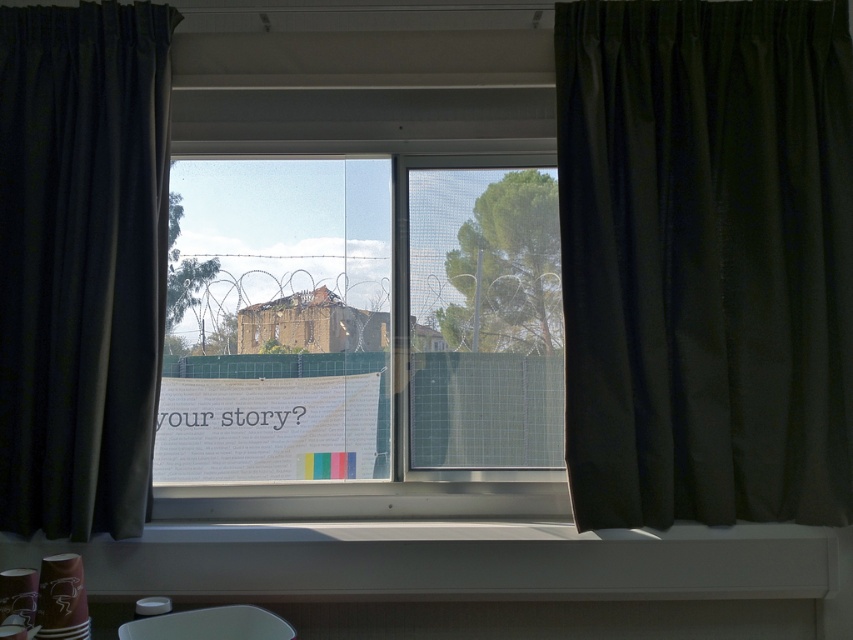
Locate an element on the screen. The image size is (853, 640). black silk curtain at right is located at coordinates (706, 259).

Measure the distance from black silk curtain at right to black fabric curtain at left.

black silk curtain at right and black fabric curtain at left are 1.14 meters apart from each other.

The image size is (853, 640). What are the coordinates of `black silk curtain at right` in the screenshot? It's located at (706, 259).

Does point (167, 44) come in front of point (294, 532)?

That is False.

The width and height of the screenshot is (853, 640). What do you see at coordinates (80, 262) in the screenshot?
I see `black fabric curtain at left` at bounding box center [80, 262].

Is point (79, 358) positioned before point (157, 566)?

Yes, point (79, 358) is in front of point (157, 566).

Locate an element on the screen. The height and width of the screenshot is (640, 853). black fabric curtain at left is located at coordinates (80, 262).

Can you confirm if black silk curtain at right is positioned below white plastic window sill at lower center?

No, black silk curtain at right is not below white plastic window sill at lower center.

Is black silk curtain at right further to the viewer compared to white plastic window sill at lower center?

Yes, black silk curtain at right is further from the viewer.

Where is `black silk curtain at right`? black silk curtain at right is located at coordinates (706, 259).